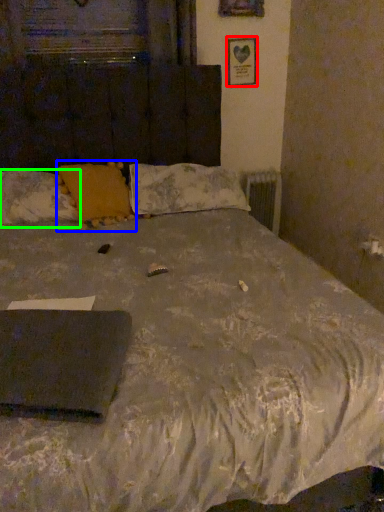
Question: Estimate the real-world distances between objects in this image. Which object is farther from picture frame (highlighted by a red box), pillow (highlighted by a blue box) or pillow (highlighted by a green box)?

Choices:
 (A) pillow
 (B) pillow

Answer: (B)